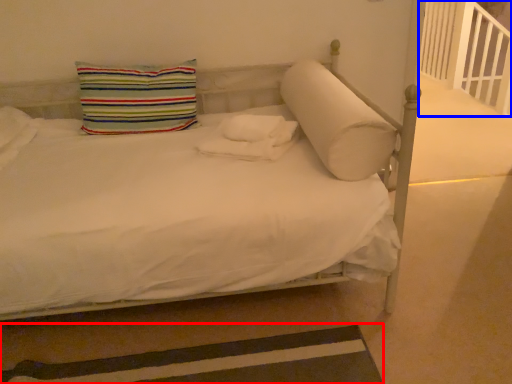
Question: Which object appears farthest to the camera in this image, strip (highlighted by a red box) or balustrade (highlighted by a blue box)?

Choices:
 (A) strip
 (B) balustrade

Answer: (B)